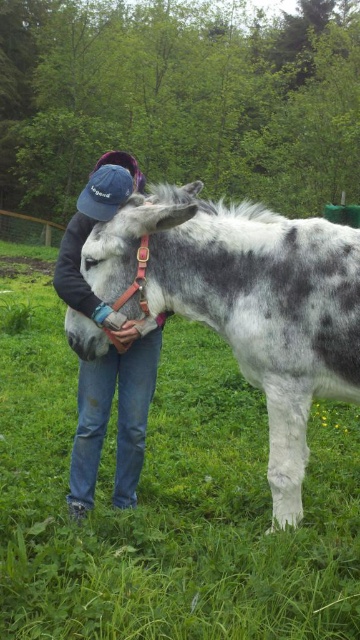
Question: Which point is closer to the camera?

Choices:
 (A) denim cap at center
 (B) spotted fur mule at center

Answer: (B)

Question: Does spotted fur mule at center come behind denim cap at center?

Choices:
 (A) yes
 (B) no

Answer: (B)

Question: Among these objects, which one is farthest from the camera?

Choices:
 (A) denim cap at center
 (B) spotted fur mule at center

Answer: (A)

Question: Observing the image, what is the correct spatial positioning of spotted fur mule at center in reference to denim cap at center?

Choices:
 (A) above
 (B) below

Answer: (A)

Question: Does spotted fur mule at center come in front of denim cap at center?

Choices:
 (A) no
 (B) yes

Answer: (B)